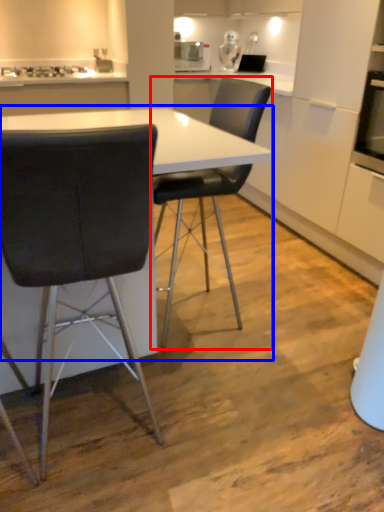
Question: Which of the following is the closest to the observer, chair (highlighted by a red box) or table (highlighted by a blue box)?

Choices:
 (A) chair
 (B) table

Answer: (B)